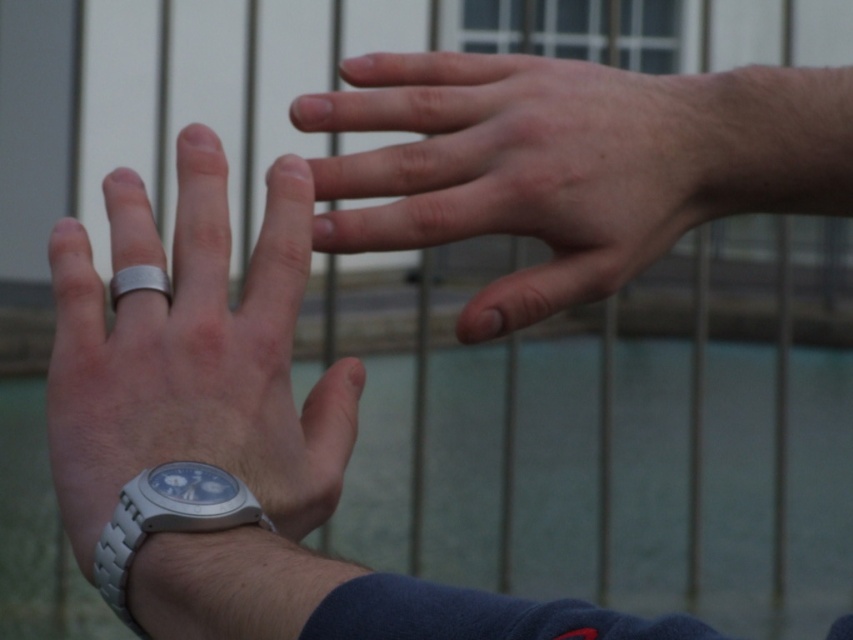
Does point (225, 221) come closer to viewer compared to point (144, 266)?

Yes.

Does silver metallic watch at left have a lesser height compared to silver metallic ring at center?

Incorrect, silver metallic watch at left's height does not fall short of silver metallic ring at center's.

Where is `silver metallic watch at left`? This screenshot has height=640, width=853. silver metallic watch at left is located at coordinates (201, 387).

Find the location of a particular element. This screenshot has height=640, width=853. silver metallic watch at left is located at coordinates (201, 387).

Which is below, smooth skin hand at upper center or silver metallic watch at lower left?

Positioned lower is silver metallic watch at lower left.

Between smooth skin hand at upper center and silver metallic watch at lower left, which one appears on the right side from the viewer's perspective?

smooth skin hand at upper center is more to the right.

This screenshot has width=853, height=640. Identify the location of smooth skin hand at upper center. (527, 168).

Is silver metallic watch at left shorter than silver metallic watch at lower left?

No, silver metallic watch at left is not shorter than silver metallic watch at lower left.

Which is above, silver metallic watch at left or silver metallic watch at lower left?

silver metallic watch at left is above.

Which is behind, point (53, 460) or point (111, 609)?

Positioned behind is point (53, 460).

Identify the location of silver metallic watch at left. (201, 387).